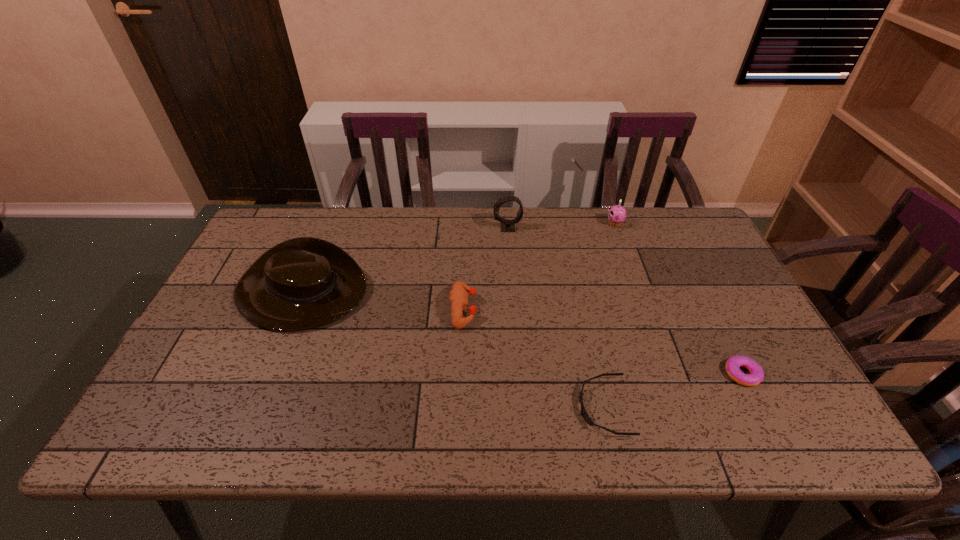
In the image, there is a desktop. Identify the location of vacant space at the near right corner. (752, 411).

The height and width of the screenshot is (540, 960). Identify the location of vacant space that's between the leftmost object and the tallest object. (404, 260).

The width and height of the screenshot is (960, 540). What are the coordinates of `free area in between the rightmost object and the cowboy hat` in the screenshot? It's located at (521, 333).

The image size is (960, 540). I want to click on empty space that is in between the leftmost object and the watch, so click(404, 260).

Find the location of `vacant area that lies between the cupcake and the shortest object`. vacant area that lies between the cupcake and the shortest object is located at coordinates (610, 315).

Locate an element on the screen. This screenshot has width=960, height=540. vacant point located between the leftmost object and the shortest object is located at coordinates (452, 349).

This screenshot has height=540, width=960. Identify the location of vacant region between the second object from right to left and the watch. (561, 226).

This screenshot has height=540, width=960. Find the location of `free space that is in between the watch and the cowboy hat`. free space that is in between the watch and the cowboy hat is located at coordinates (404, 260).

This screenshot has width=960, height=540. Identify the location of free space between the tallest object and the rightmost object. (625, 301).

Identify the location of vacant space in between the tallest object and the sunglasses. (556, 318).